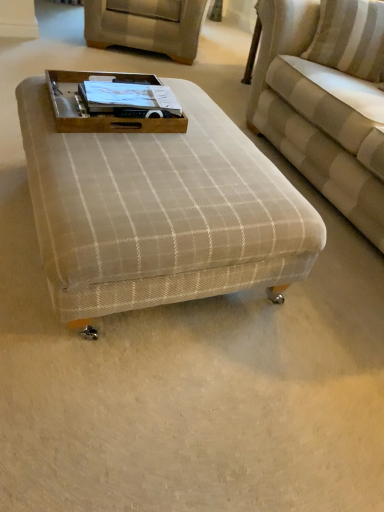
Question: Is beige fabric swivel chair at upper center thinner than beige plaid ottoman at center?

Choices:
 (A) yes
 (B) no

Answer: (B)

Question: Does beige fabric swivel chair at upper center have a larger size compared to beige plaid ottoman at center?

Choices:
 (A) no
 (B) yes

Answer: (B)

Question: Is beige fabric swivel chair at upper center wider than beige plaid ottoman at center?

Choices:
 (A) no
 (B) yes

Answer: (B)

Question: Is beige fabric swivel chair at upper center at the right side of beige plaid ottoman at center?

Choices:
 (A) yes
 (B) no

Answer: (B)

Question: Are beige fabric swivel chair at upper center and beige plaid ottoman at center located far from each other?

Choices:
 (A) yes
 (B) no

Answer: (A)

Question: Visually, is beige plaid ottoman at center positioned to the left or to the right of beige fabric swivel chair at upper center?

Choices:
 (A) left
 (B) right

Answer: (B)

Question: In terms of size, does beige plaid ottoman at center appear bigger or smaller than beige fabric swivel chair at upper center?

Choices:
 (A) small
 (B) big

Answer: (A)

Question: Is point (244, 159) closer or farther from the camera than point (153, 10)?

Choices:
 (A) closer
 (B) farther

Answer: (A)

Question: In terms of height, does beige plaid ottoman at center look taller or shorter compared to beige fabric swivel chair at upper center?

Choices:
 (A) tall
 (B) short

Answer: (B)

Question: Would you say brown wooden tray at center is to the left or to the right of beige striped fabric couch at upper right in the picture?

Choices:
 (A) right
 (B) left

Answer: (B)

Question: From the image's perspective, is brown wooden tray at center above or below beige striped fabric couch at upper right?

Choices:
 (A) above
 (B) below

Answer: (B)

Question: Considering their positions, is brown wooden tray at center located in front of or behind beige striped fabric couch at upper right?

Choices:
 (A) behind
 (B) front

Answer: (A)

Question: Is brown wooden tray at center taller or shorter than beige striped fabric couch at upper right?

Choices:
 (A) short
 (B) tall

Answer: (A)

Question: Does point (134, 47) appear closer or farther from the camera than point (382, 15)?

Choices:
 (A) farther
 (B) closer

Answer: (A)

Question: In terms of height, does beige fabric swivel chair at upper center look taller or shorter compared to beige striped fabric couch at upper right?

Choices:
 (A) short
 (B) tall

Answer: (A)